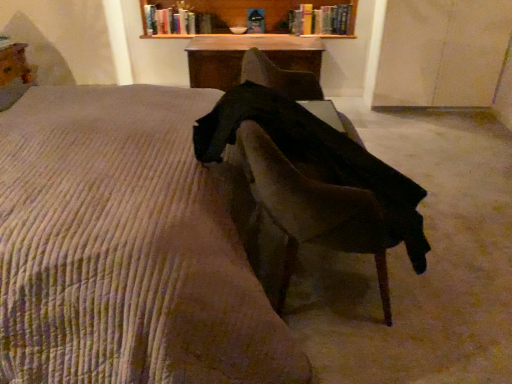
Image resolution: width=512 pixels, height=384 pixels. I want to click on hardcover book at upper center, which is the second book in left-to-right order, so click(322, 20).

What do you see at coordinates (214, 15) in the screenshot? The width and height of the screenshot is (512, 384). I see `wooden at upper center` at bounding box center [214, 15].

Locate an element on the screen. wooden table at upper center, which is the second table from right to left is located at coordinates (14, 64).

Describe the element at coordinates (177, 20) in the screenshot. I see `hardcover book at upper center, the 2th book viewed from the right` at that location.

Image resolution: width=512 pixels, height=384 pixels. Identify the location of corduroy bedspread at center. (129, 247).

This screenshot has width=512, height=384. What do you see at coordinates (129, 247) in the screenshot? I see `corduroy bedspread at center` at bounding box center [129, 247].

Where is `dark fabric chair at center`? This screenshot has height=384, width=512. dark fabric chair at center is located at coordinates (315, 210).

From the image's perspective, relative to hardcover book at upper center, which is the second book in left-to-right order, is dark fabric chair at center above or below?

dark fabric chair at center is situated lower than hardcover book at upper center, which is the second book in left-to-right order, in the image.

Which book is the 1st one when counting from the back of the dark fabric chair at center? Please provide its 2D coordinates.

[(322, 20)]

From a real-world perspective, is dark fabric chair at center below hardcover book at upper center, which is the second book in left-to-right order?

Correct, in the physical world, dark fabric chair at center is lower than hardcover book at upper center, which is the second book in left-to-right order.

Can we say dark fabric chair at center lies outside hardcover book at upper center, which is the second book in left-to-right order?

That's correct, dark fabric chair at center is outside of hardcover book at upper center, which is the second book in left-to-right order.

Does wooden at upper center have a greater width compared to hardcover book at upper center, which is counted as the first book, starting from the left?

Yes, wooden at upper center is wider than hardcover book at upper center, which is counted as the first book, starting from the left.

Does wooden at upper center have a larger size compared to hardcover book at upper center, which is counted as the first book, starting from the left?

Yes.

Is wooden at upper center to the left or to the right of hardcover book at upper center, the 2th book viewed from the right, in the image?

From the image, it's evident that wooden at upper center is to the right of hardcover book at upper center, the 2th book viewed from the right.

From the image's perspective, which is below, wooden at upper center or hardcover book at upper center, the 2th book viewed from the right?

hardcover book at upper center, the 2th book viewed from the right, from the image's perspective.

Is wooden table at upper center, the 1th table when ordered from left to right, surrounded by corduroy bedspread at center?

No, wooden table at upper center, the 1th table when ordered from left to right, is not inside corduroy bedspread at center.

Locate an element on the screen. Image resolution: width=512 pixels, height=384 pixels. table to the left of corduroy bedspread at center is located at coordinates (14, 64).

Based on their sizes in the image, would you say corduroy bedspread at center is bigger or smaller than wooden table at upper center, which is counted as the first table, starting from the front?

In the image, corduroy bedspread at center appears to be larger than wooden table at upper center, which is counted as the first table, starting from the front.

Is corduroy bedspread at center next to wooden table at upper center, the 1th table when ordered from left to right, and touching it?

There is a gap between corduroy bedspread at center and wooden table at upper center, the 1th table when ordered from left to right.

Considering the relative positions of hardcover book at upper center, the 2th book viewed from the right, and wooden at upper center in the image provided, is hardcover book at upper center, the 2th book viewed from the right, in front of wooden at upper center?

No, it is not.

Can you confirm if hardcover book at upper center, the 2th book viewed from the right, is positioned to the left of wooden at upper center?

Indeed, hardcover book at upper center, the 2th book viewed from the right, is positioned on the left side of wooden at upper center.

Is point (176, 12) more distant than point (165, 29)?

No, (176, 12) is closer to viewer.

Consider the image. Is wooden table at upper center, which is counted as the first table, starting from the front, touching wooden table at center, which ranks as the second table in left-to-right order?

No, wooden table at upper center, which is counted as the first table, starting from the front, is not touching wooden table at center, which ranks as the second table in left-to-right order.

Is wooden table at upper center, which is the second table from right to left, positioned beyond the bounds of wooden table at center, marked as the 1th table in a back-to-front arrangement?

Yes.

Considering their positions, is wooden table at upper center, the 1th table when ordered from left to right, located in front of or behind wooden table at center, the second table viewed from the front?

wooden table at upper center, the 1th table when ordered from left to right, is in front of wooden table at center, the second table viewed from the front.

Which of these two, wooden table at upper center, the 1th table when ordered from left to right, or wooden table at center, the first table from the right, is smaller?

Smaller between the two is wooden table at upper center, the 1th table when ordered from left to right.

From a real-world perspective, is wooden table at center, which ranks as the second table in left-to-right order, below dark fabric chair at center?

Indeed, from a real-world perspective, wooden table at center, which ranks as the second table in left-to-right order, is positioned beneath dark fabric chair at center.

From the image's perspective, between wooden table at center, the first table from the right, and dark fabric chair at center, which one is located above?

wooden table at center, the first table from the right.

From the image's perspective, which table is the 2nd one above the dark fabric chair at center? Please provide its 2D coordinates.

[(243, 56)]

In the scene shown: Is wooden table at center, the second table viewed from the front, located outside dark fabric chair at center?

Absolutely, wooden table at center, the second table viewed from the front, is external to dark fabric chair at center.

In terms of width, does wooden at upper center look wider or thinner when compared to dark fabric chair at center?

wooden at upper center is thinner than dark fabric chair at center.

Which object is positioned more to the left, wooden at upper center or dark fabric chair at center?

wooden at upper center is more to the left.

From a real-world perspective, which object stands above the other?

wooden at upper center.

Looking at this image, considering the sizes of objects wooden at upper center and dark fabric chair at center in the image provided, who is smaller, wooden at upper center or dark fabric chair at center?

With smaller size is wooden at upper center.

Find the location of `chair located in front of the hardcover book at upper center, the first book from the right`. chair located in front of the hardcover book at upper center, the first book from the right is located at coordinates (315, 210).

You are a GUI agent. You are given a task and a screenshot of the screen. Output one action in this format:
    pyautogui.click(x=<x>, y=<y>)
    Task: Click on the shelf above the hardcover book at upper center, the 2th book viewed from the right (from a real-world perspective)
    
    Given the screenshot: What is the action you would take?
    pyautogui.click(x=214, y=15)

From the image, which object appears to be nearer to hardcover book at upper center, which is counted as the first book, starting from the left, corduroy bedspread at center or wooden table at upper center, positioned as the 2th table in back-to-front order?

wooden table at upper center, positioned as the 2th table in back-to-front order.

Based on their spatial positions, is dark fabric chair at center or wooden table at center, the first table from the right, closer to wooden table at upper center, which is the second table from right to left?

wooden table at center, the first table from the right, lies closer to wooden table at upper center, which is the second table from right to left, than the other object.

When comparing their distances from hardcover book at upper center, the 2th book viewed from the right, does wooden table at upper center, which is counted as the first table, starting from the front, or wooden table at center, which ranks as the second table in left-to-right order, seem closer?

Based on the image, wooden table at center, which ranks as the second table in left-to-right order, appears to be nearer to hardcover book at upper center, the 2th book viewed from the right.

Which object lies further to the anchor point hardcover book at upper center, which is counted as the first book, starting from the left, dark fabric chair at center or wooden table at center, the first table from the right?

The object further to hardcover book at upper center, which is counted as the first book, starting from the left, is dark fabric chair at center.

Looking at the image, which one is located further to corduroy bedspread at center, dark fabric chair at center or wooden at upper center?

wooden at upper center is further to corduroy bedspread at center.

Which object lies nearer to the anchor point wooden table at center, marked as the 1th table in a back-to-front arrangement, hardcover book at upper center, which is the second book in left-to-right order, or dark fabric chair at center?

hardcover book at upper center, which is the second book in left-to-right order, is positioned closer to the anchor wooden table at center, marked as the 1th table in a back-to-front arrangement.

Based on their spatial positions, is hardcover book at upper center, which is counted as the first book, starting from the left, or wooden table at upper center, which is counted as the first table, starting from the front, further from hardcover book at upper center, the first book from the right?

wooden table at upper center, which is counted as the first table, starting from the front, lies further to hardcover book at upper center, the first book from the right, than the other object.

Consider the image. Which object lies further to the anchor point wooden table at upper center, which is counted as the first table, starting from the front, corduroy bedspread at center or wooden table at center, the first table from the right?

Among the two, corduroy bedspread at center is located further to wooden table at upper center, which is counted as the first table, starting from the front.

Locate an element on the screen. book situated between wooden table at upper center, positioned as the 2th table in back-to-front order, and wooden table at center, the first table from the right, from left to right is located at coordinates (177, 20).

You are a GUI agent. You are given a task and a screenshot of the screen. Output one action in this format:
    pyautogui.click(x=<x>, y=<y>)
    Task: Click on the table located between hardcover book at upper center, which is counted as the first book, starting from the left, and hardcover book at upper center, which is the second book in left-to-right order, in the left-right direction
    Image resolution: width=512 pixels, height=384 pixels.
    Given the screenshot: What is the action you would take?
    pyautogui.click(x=243, y=56)

The image size is (512, 384). I want to click on book situated between wooden table at upper center, positioned as the 2th table in back-to-front order, and hardcover book at upper center, the first book from the right, from left to right, so point(177,20).

At what (x,y) coordinates should I click in order to perform the action: click on table between wooden table at upper center, positioned as the 2th table in back-to-front order, and hardcover book at upper center, which is the second book in left-to-right order, from left to right. Please return your answer as a coordinate pair (x, y). This screenshot has height=384, width=512. Looking at the image, I should click on (243, 56).